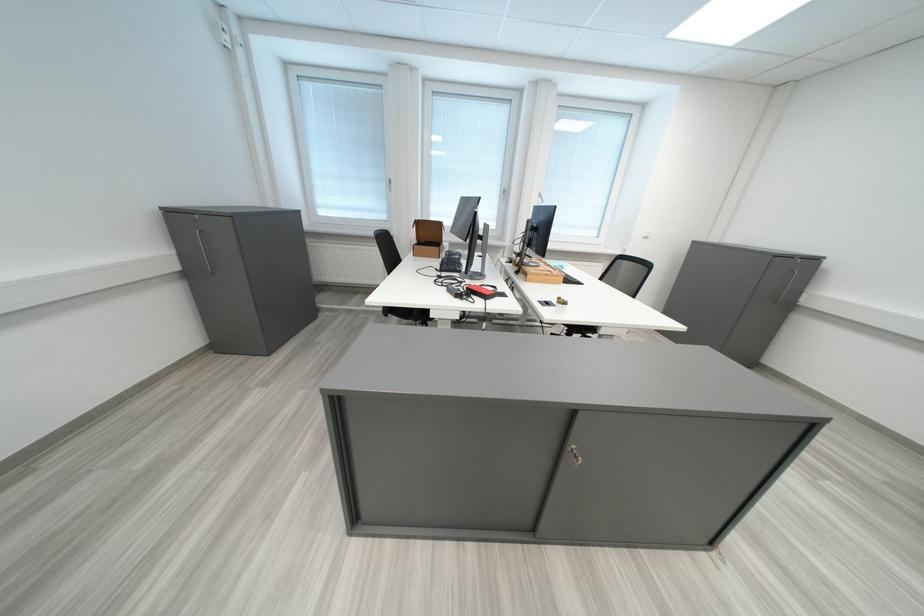
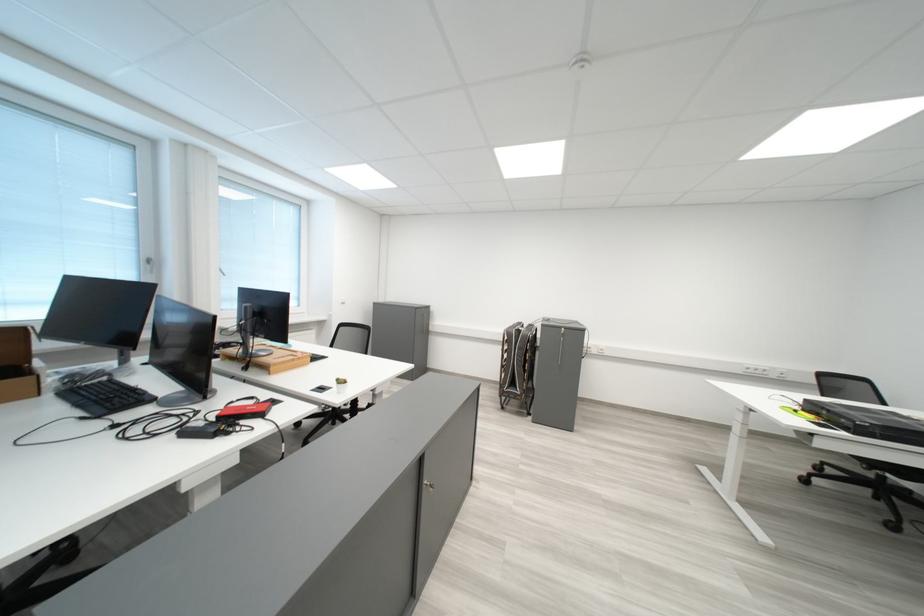
Find the pixel in the second image that matches pixel 463 292 in the first image.

(200, 436)